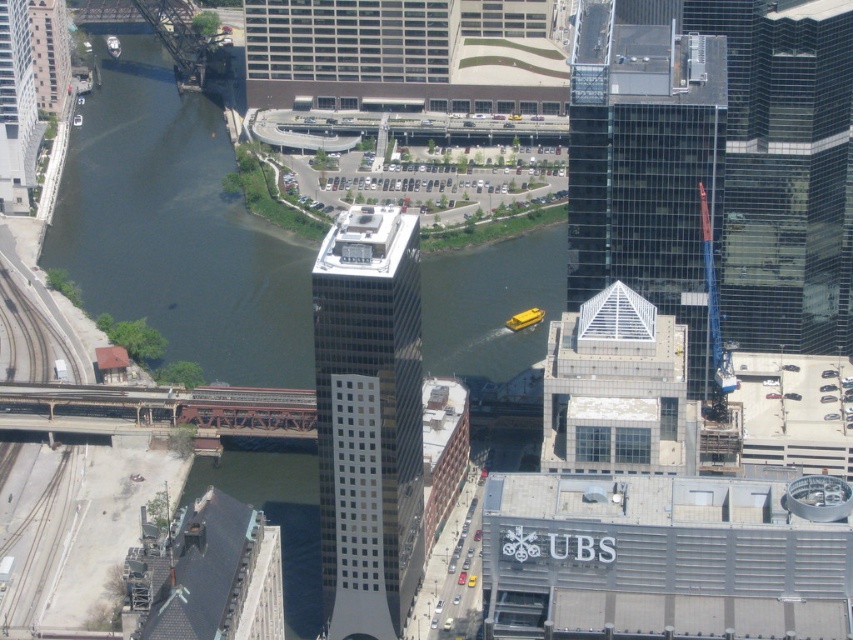
At what (x,y) coordinates should I click in order to perform the action: click on dark green water at left. Please return your answer as a coordinate pair (x, y). This screenshot has height=640, width=853. Looking at the image, I should click on (177, 228).

Which of these two, dark green water at left or metallic glass skyscraper at center, stands taller?

With more height is dark green water at left.

Between point (154, 221) and point (383, 387), which one is positioned behind?

Positioned behind is point (154, 221).

Locate an element on the screen. Image resolution: width=853 pixels, height=640 pixels. dark green water at left is located at coordinates (177, 228).

Can you confirm if dark green water at left is smaller than transparent glass skyscraper at center?

Actually, dark green water at left might be larger than transparent glass skyscraper at center.

Is dark green water at left taller than transparent glass skyscraper at center?

Yes, dark green water at left is taller than transparent glass skyscraper at center.

Find the location of a particular element. dark green water at left is located at coordinates (177, 228).

Identify the location of dark green water at left. Image resolution: width=853 pixels, height=640 pixels. (177, 228).

Is transparent glass skyscraper at center behind metallic glass skyscraper at center?

Yes, transparent glass skyscraper at center is behind metallic glass skyscraper at center.

Which is more to the left, transparent glass skyscraper at center or metallic glass skyscraper at center?

metallic glass skyscraper at center

Is point (619, 140) positioned before point (379, 483)?

That is False.

What are the coordinates of `transparent glass skyscraper at center` in the screenshot? It's located at (643, 161).